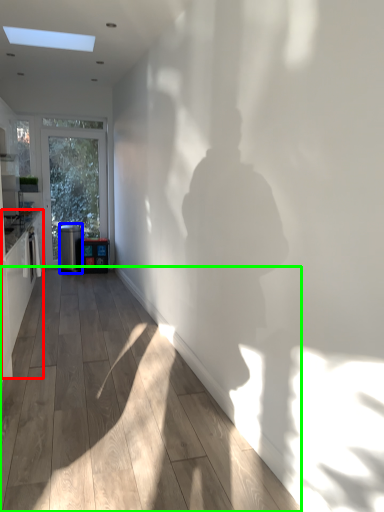
Question: Estimate the real-world distances between objects in this image. Which object is farther from cabinetry (highlighted by a red box), appliance (highlighted by a blue box) or corridor (highlighted by a green box)?

Choices:
 (A) appliance
 (B) corridor

Answer: (A)